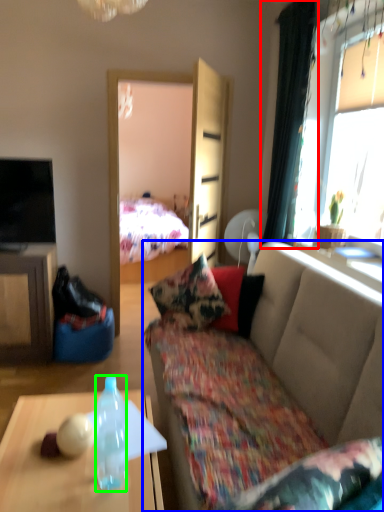
Question: Estimate the real-world distances between objects in this image. Which object is farther from curtain (highlighted by a red box), studio couch (highlighted by a blue box) or bottle (highlighted by a green box)?

Choices:
 (A) studio couch
 (B) bottle

Answer: (B)